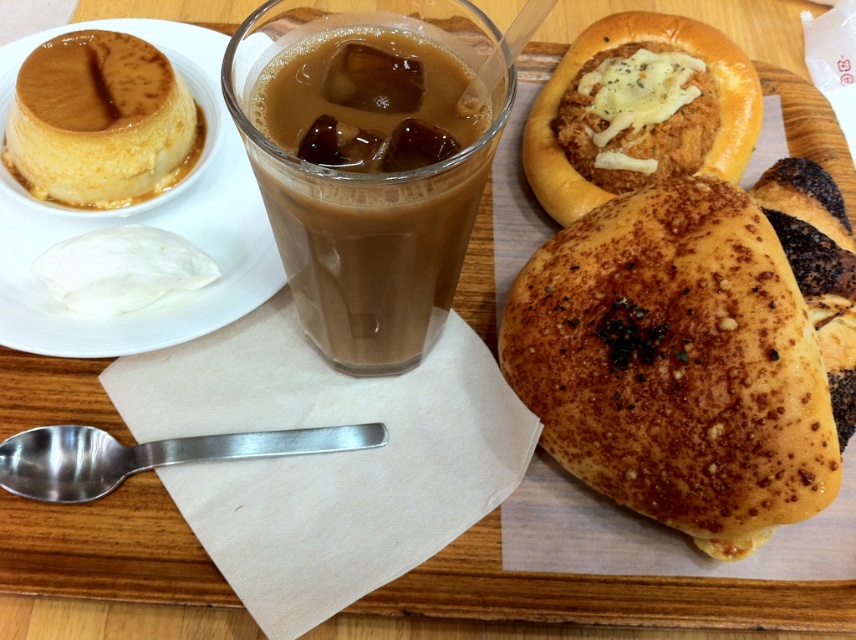
Question: Among these objects, which one is farthest from the camera?

Choices:
 (A) brown translucent glass at center
 (B) golden brown crusty bread at right
 (C) golden-brown crusty bread at upper right

Answer: (C)

Question: Which object is the farthest from the golden caramel flan at upper left?

Choices:
 (A) golden brown crusty bread at right
 (B) brown translucent glass at center
 (C) matte caramel flan at upper left
 (D) golden brown crusty bun at center right

Answer: (A)

Question: Can you confirm if matte caramel flan at upper left is positioned below white creamy mozzarella at upper left?

Choices:
 (A) no
 (B) yes

Answer: (A)

Question: Does golden brown crusty bun at center right have a greater width compared to brown translucent glass at center?

Choices:
 (A) no
 (B) yes

Answer: (B)

Question: Which object is positioned farthest from the golden brown crusty bun at center right?

Choices:
 (A) white creamy mozzarella at upper left
 (B) brown translucent glass at center
 (C) golden caramel flan at upper left

Answer: (C)

Question: Does golden brown crusty bread at right have a lesser width compared to white creamy mozzarella at upper left?

Choices:
 (A) yes
 (B) no

Answer: (A)